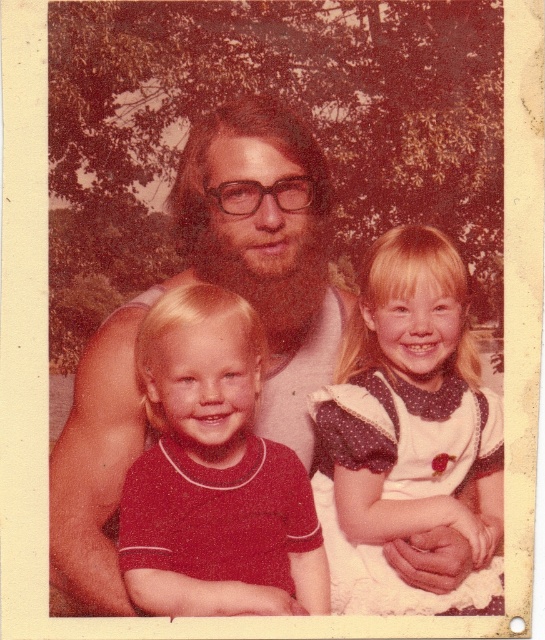
You are a photographer trying to capture a clear image of the matte white shirt at center and the matte red shirt at center. Which one would be in focus if you focus on the background?

The matte red shirt at center is behind the matte white shirt at center, so focusing on the background would put the matte red shirt at center in focus while the matte white shirt at center might be slightly out of focus.

You are a photographer trying to focus on the matte white shirt at center and the white dotted dress at center in this vintage photo. Which one do you need to adjust your camera focus for first?

The matte white shirt at center is closer to the viewer than the white dotted dress at center, so you should focus on the matte white shirt at center first before adjusting for the white dotted dress at center.

What is the exact coordinate of the matte white shirt at center?

The matte white shirt at center is located at point (x=223, y=285).